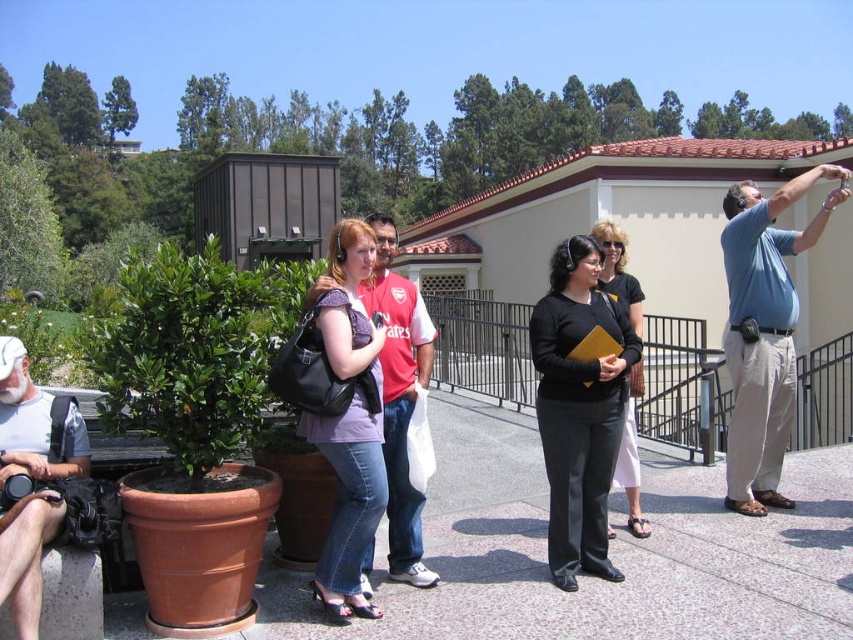
Question: Among these points, which one is nearest to the camera?

Choices:
 (A) pyautogui.click(x=421, y=330)
 (B) pyautogui.click(x=630, y=304)
 (C) pyautogui.click(x=537, y=349)
 (D) pyautogui.click(x=10, y=416)

Answer: (D)

Question: Can you confirm if black matte pants at center is positioned below denim jeans at center?

Choices:
 (A) no
 (B) yes

Answer: (B)

Question: Does denim jeans at center appear on the left side of black leather pants at center?

Choices:
 (A) no
 (B) yes

Answer: (B)

Question: Among these objects, which one is farthest from the camera?

Choices:
 (A) denim jeans at center
 (B) black matte pants at center
 (C) black leather pants at center

Answer: (C)

Question: Estimate the real-world distances between objects in this image. Which object is farther from the matte red shirt at center?

Choices:
 (A) black matte pants at center
 (B) blue cotton shirt at upper right

Answer: (B)

Question: Can you confirm if matte red shirt at center is wider than black leather pants at center?

Choices:
 (A) no
 (B) yes

Answer: (A)